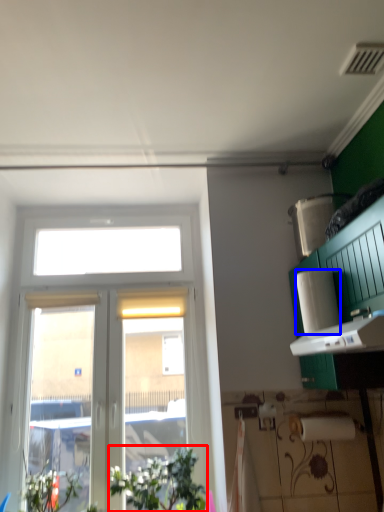
Question: Which object is closer to the camera taking this photo, plant (highlighted by a red box) or paper towel (highlighted by a blue box)?

Choices:
 (A) plant
 (B) paper towel

Answer: (B)